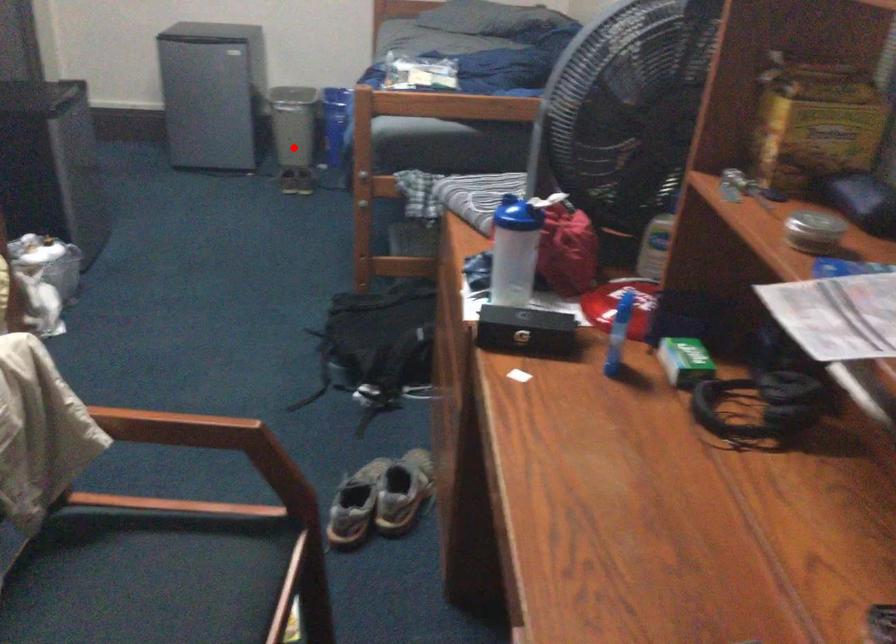
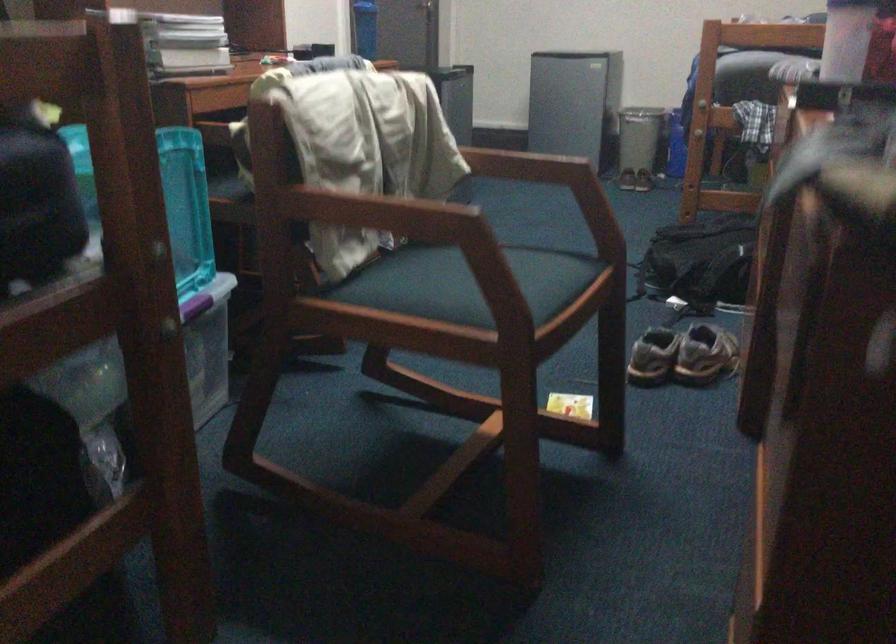
Where in the second image is the point corresponding to the highlighted location from the first image?

(638, 146)